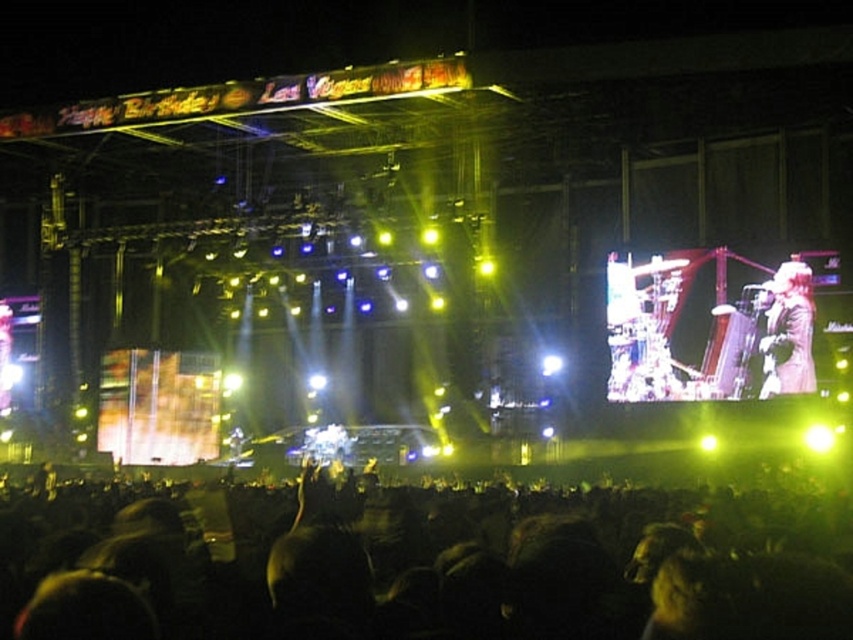
Question: Can you confirm if black matte crowd at lower center is positioned above shiny black jacket at right?

Choices:
 (A) yes
 (B) no

Answer: (B)

Question: Does black matte crowd at lower center appear over shiny black jacket at right?

Choices:
 (A) yes
 (B) no

Answer: (B)

Question: Can you confirm if black matte crowd at lower center is positioned above shiny black jacket at right?

Choices:
 (A) yes
 (B) no

Answer: (B)

Question: Which point is closer to the camera?

Choices:
 (A) (45, 540)
 (B) (798, 346)

Answer: (A)

Question: Which object is closer to the camera taking this photo?

Choices:
 (A) shiny black jacket at right
 (B) black matte crowd at lower center

Answer: (B)